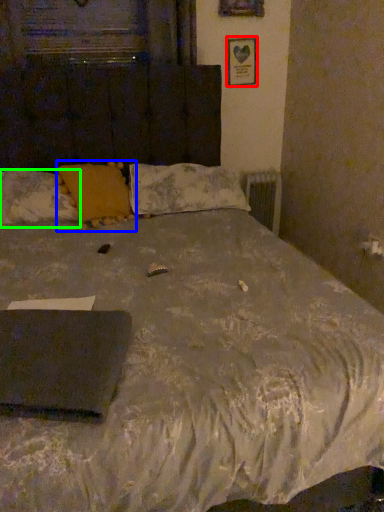
Question: Considering the real-world distances, which object is closest to picture frame (highlighted by a red box)? pillow (highlighted by a blue box) or pillow (highlighted by a green box).

Choices:
 (A) pillow
 (B) pillow

Answer: (A)